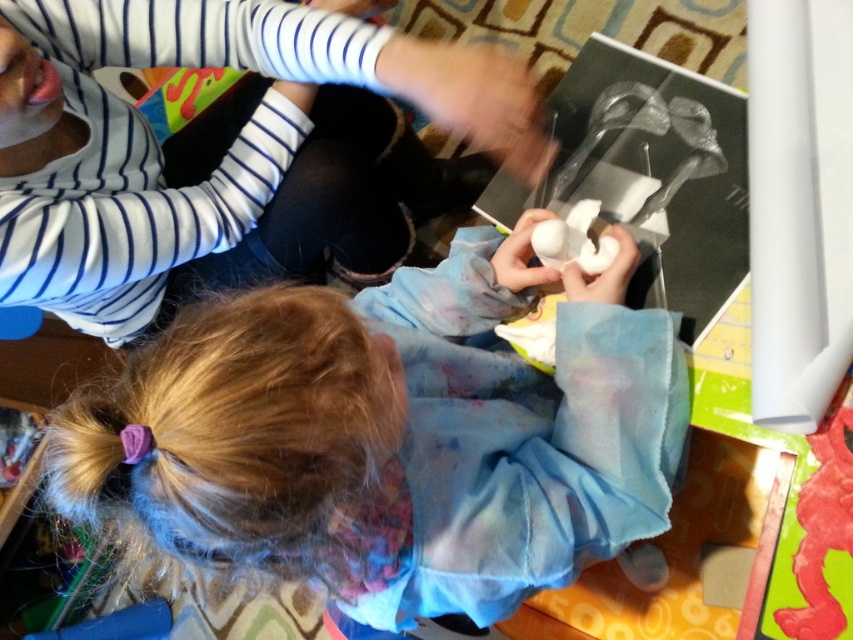
Question: From the image, what is the correct spatial relationship of white fabric at center in relation to white matte shirt at upper left?

Choices:
 (A) left
 (B) right

Answer: (B)

Question: Is white fabric at center positioned in front of white matte shirt at upper left?

Choices:
 (A) yes
 (B) no

Answer: (A)

Question: Which point appears farthest from the camera in this image?

Choices:
 (A) (144, 180)
 (B) (552, 499)

Answer: (A)

Question: Among these objects, which one is farthest from the camera?

Choices:
 (A) white fabric at center
 (B) white matte shirt at upper left

Answer: (B)

Question: Which object appears farthest from the camera in this image?

Choices:
 (A) white matte shirt at upper left
 (B) white fabric at center

Answer: (A)

Question: Where is white fabric at center located in relation to white matte shirt at upper left in the image?

Choices:
 (A) left
 (B) right

Answer: (B)